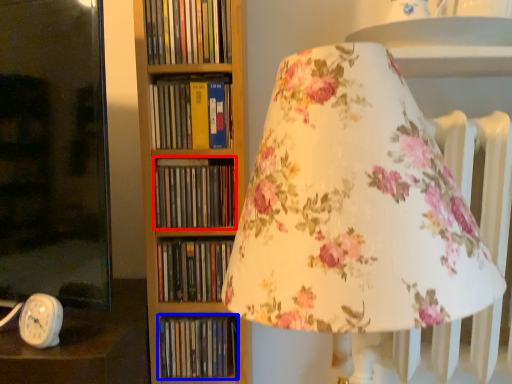
Question: Which object appears closest to the camera in this image, book (highlighted by a red box) or book (highlighted by a blue box)?

Choices:
 (A) book
 (B) book

Answer: (A)